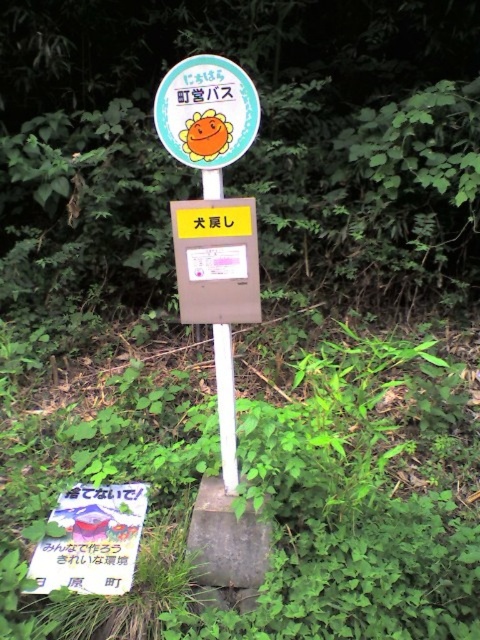
Is matte brown box at center bigger than white plastic sign at center?

Correct, matte brown box at center is larger in size than white plastic sign at center.

Is matte brown box at center smaller than white plastic sign at center?

A: No, matte brown box at center is not smaller than white plastic sign at center.

Between point (195, 257) and point (181, 81), which one is positioned in front?

Point (181, 81) is more forward.

Identify the location of matte brown box at center. (216, 260).

Does matte brown box at center have a larger size compared to brown wood pole at center?

No.

Is matte brown box at center taller than brown wood pole at center?

Incorrect, matte brown box at center's height is not larger of brown wood pole at center's.

Between point (244, 296) and point (223, 452), which one is positioned behind?

Point (223, 452)

The width and height of the screenshot is (480, 640). I want to click on matte brown box at center, so click(216, 260).

Is matte plastic sign at center further to camera compared to brown wood pole at center?

No, matte plastic sign at center is in front of brown wood pole at center.

Does matte plastic sign at center come in front of brown wood pole at center?

Yes, it is.

What do you see at coordinates (214, 214) in the screenshot? I see `matte plastic sign at center` at bounding box center [214, 214].

I want to click on matte plastic sign at center, so click(214, 214).